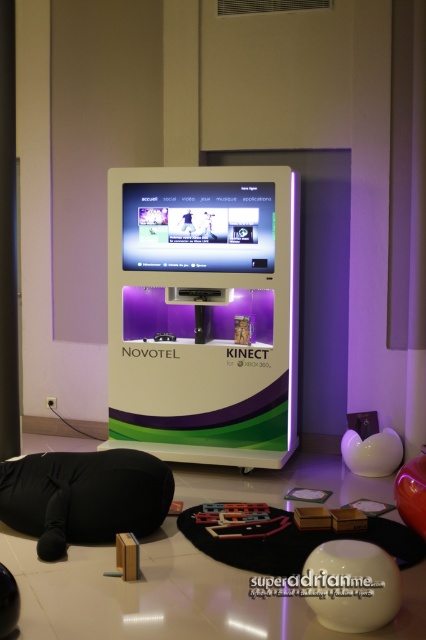
Between point (172, 436) and point (143, 486), which one is positioned in front?

Positioned in front is point (143, 486).

Is point (296, 444) less distant than point (6, 486)?

No, it is behind (6, 486).

Where is `matte plastic vending machine at center`? matte plastic vending machine at center is located at coordinates (203, 314).